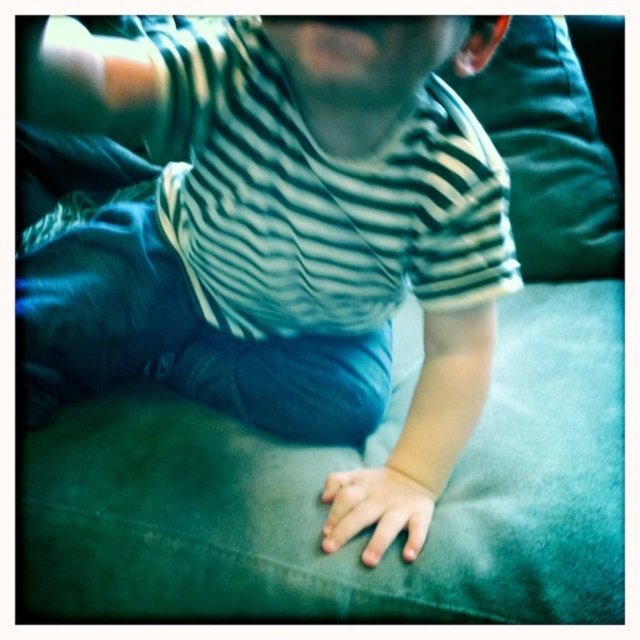
Question: Estimate the real-world distances between objects in this image. Which object is farther from the smooth skin hand at center?

Choices:
 (A) green fabric pillow at upper right
 (B) striped cotton shirt at center

Answer: (A)

Question: Is striped cotton shirt at center to the left of smooth skin hand at center from the viewer's perspective?

Choices:
 (A) no
 (B) yes

Answer: (B)

Question: Which point appears closest to the camera in this image?

Choices:
 (A) (531, 113)
 (B) (381, 490)

Answer: (B)

Question: Can you confirm if green fabric pillow at upper right is positioned to the right of smooth skin hand at center?

Choices:
 (A) no
 (B) yes

Answer: (B)

Question: Can you confirm if striped cotton shirt at center is smaller than green fabric pillow at upper right?

Choices:
 (A) yes
 (B) no

Answer: (B)

Question: Which is farther from the green fabric pillow at upper right?

Choices:
 (A) smooth skin hand at center
 (B) striped cotton shirt at center

Answer: (A)